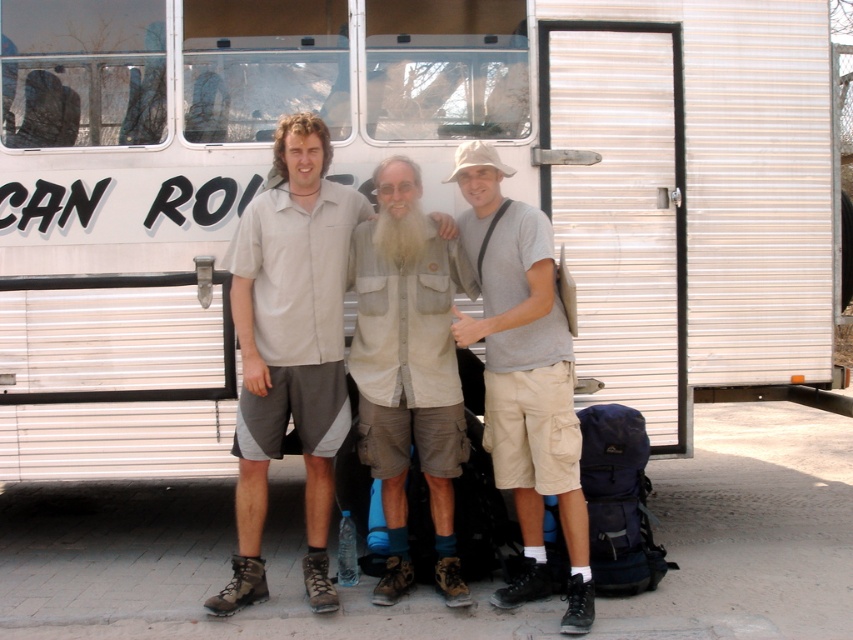
What do you see at coordinates (289, 348) in the screenshot?
I see `light beige shirt at center` at bounding box center [289, 348].

Who is more forward, (328, 456) or (526, 488)?

Point (526, 488)

You are a GUI agent. You are given a task and a screenshot of the screen. Output one action in this format:
    pyautogui.click(x=<x>, y=<y>)
    Task: Click on the light beige shirt at center
    This screenshot has width=853, height=640.
    Given the screenshot: What is the action you would take?
    pyautogui.click(x=289, y=348)

Between light beige shirt at center and light beige fabric shirt at center, which one has more height?

light beige shirt at center

Which is behind, point (227, 592) or point (451, 476)?

The point (451, 476) is more distant.

Describe the element at coordinates (289, 348) in the screenshot. I see `light beige shirt at center` at that location.

Locate an element on the screen. Image resolution: width=853 pixels, height=640 pixels. light beige shirt at center is located at coordinates (289, 348).

Does light beige fabric shirt at center appear under light gray cotton t-shirt at center?

Yes.

Can you confirm if light beige fabric shirt at center is positioned to the right of light gray cotton t-shirt at center?

Incorrect, light beige fabric shirt at center is not on the right side of light gray cotton t-shirt at center.

You are a GUI agent. You are given a task and a screenshot of the screen. Output one action in this format:
    pyautogui.click(x=<x>, y=<y>)
    Task: Click on the light beige fabric shirt at center
    
    Given the screenshot: What is the action you would take?
    pyautogui.click(x=409, y=368)

At what (x,y) coordinates should I click in order to perform the action: click on light beige fabric shirt at center. Please return your answer as a coordinate pair (x, y). Looking at the image, I should click on (409, 368).